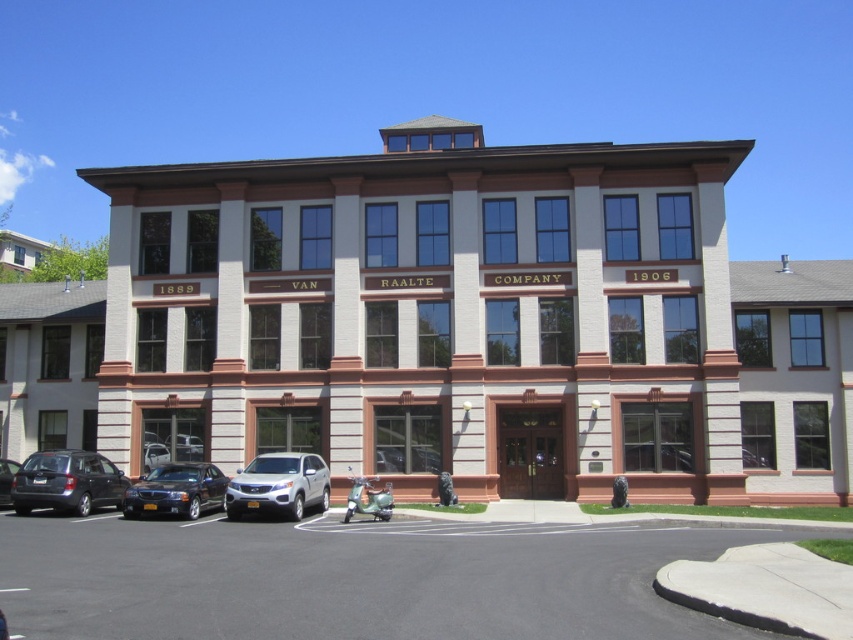
You are a delivery person who needs to park your truck between the matte gray hatchback at lower left and the shiny black sedan at lower left. The truck requires at least 7 feet of space. Can you park there?

The matte gray hatchback at lower left and the shiny black sedan at lower left are 6.29 feet apart from each other. Since the truck requires at least 7 feet of space, there is not enough room to park between them.

You are a delivery person trying to park a 1.7 meter tall delivery box in front of the building. You see a matte gray hatchback at lower left and a matte gray car at lower left. Which vehicle can the delivery box fit under without touching the roof?

The matte gray hatchback at lower left has a greater height compared to matte gray car at lower left. Since the delivery box is 1.7 meters tall, it can fit under the taller matte gray hatchback at lower left if its height exceeds 1.7 meters. However, without specific measurements, we can only conclude that the matte gray hatchback at lower left offers more vertical space than the matte gray car at lower left, making it the better option for fitting the delivery box.

You are standing in front of the building and see two points marked on the ground. One is at point [264,472] and the other is at point [4,502]. Which point is closer to you?

Point [264,472] is closer to the viewer than point [4,502].